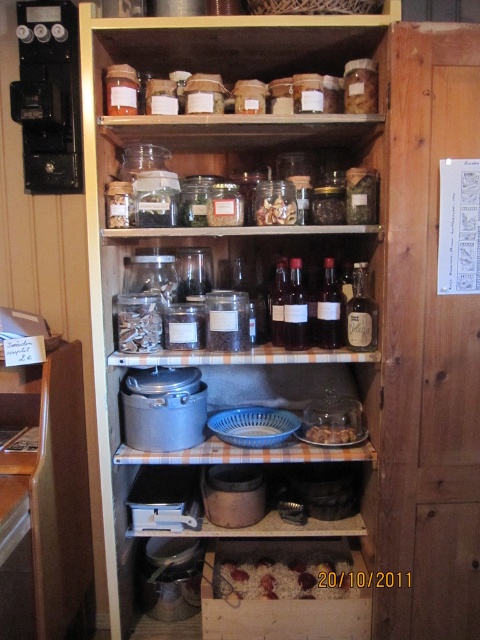
You are standing in front of the wooden storage cabinet and want to reach two points inside the cabinet. The first point is at coordinates point (x=208, y=221) and the second is at point (x=245, y=573). Which point will you touch first if you extend your hand into the cabinet?

Point (x=208, y=221) is closer to the camera than point (x=245, y=573), so you will touch point (x=208, y=221) first.

You are a chef preparing a recipe that requires precise measurements. You have to use the clear glass bottles at center and the brown crumbly food at lower center. Which of these two items is taller?

The clear glass bottles at center is much taller than the brown crumbly food at lower center.